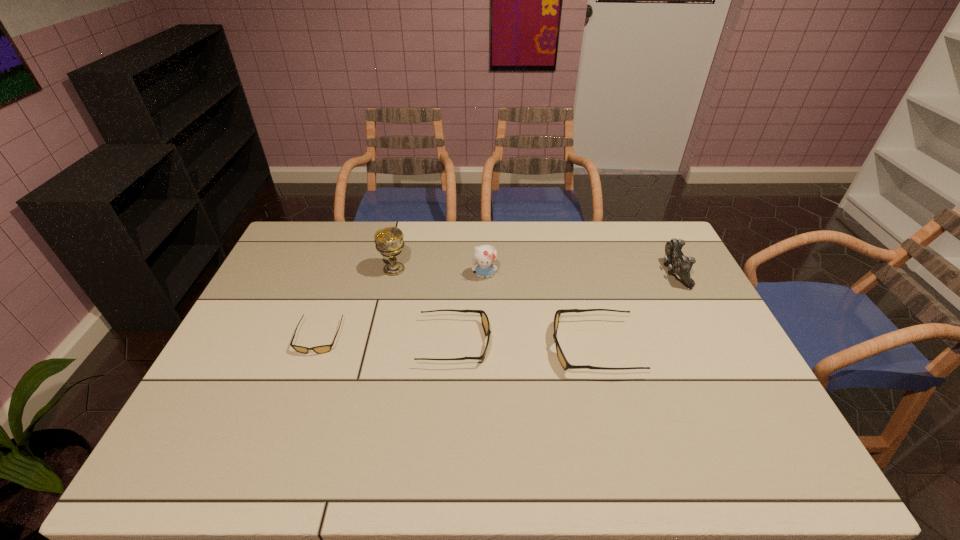
Please point a spot on the right to add another sunglasses. Please provide its 2D coordinates. Your answer should be formatted as a tuple, i.e. [(x, y)], where the tuple contains the x and y coordinates of a point satisfying the conditions above.

[(736, 353)]